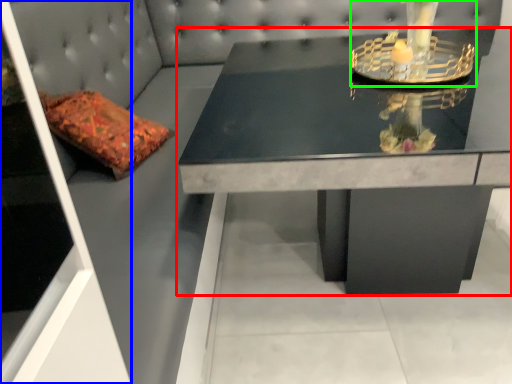
Question: Considering the real-world distances, which object is farthest from table (highlighted by a red box)? glass door (highlighted by a blue box) or candle holder (highlighted by a green box)?

Choices:
 (A) glass door
 (B) candle holder

Answer: (A)